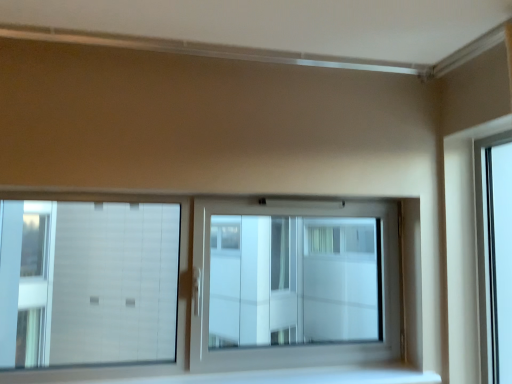
Where is `white smooth window sill at lower center`? Image resolution: width=512 pixels, height=384 pixels. white smooth window sill at lower center is located at coordinates (249, 376).

What do you see at coordinates (249, 376) in the screenshot?
I see `white smooth window sill at lower center` at bounding box center [249, 376].

The height and width of the screenshot is (384, 512). I want to click on white smooth window sill at lower center, so click(x=249, y=376).